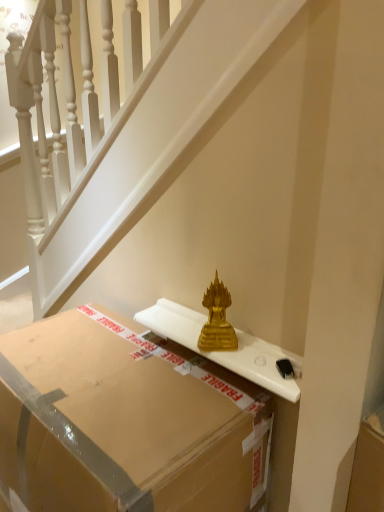
Locate an element on the screen. This screenshot has width=384, height=512. matte cardboard box at center is located at coordinates (124, 422).

Find the location of a particular element. matte cardboard box at center is located at coordinates (124, 422).

Who is smaller, matte cardboard box at center or gold metallic statue at center?

gold metallic statue at center.

Is matte cardboard box at center to the left or to the right of gold metallic statue at center in the image?

matte cardboard box at center is to the left of gold metallic statue at center.

Can you confirm if matte cardboard box at center is wider than gold metallic statue at center?

Correct, the width of matte cardboard box at center exceeds that of gold metallic statue at center.

Looking at this image, is matte cardboard box at center surrounding gold metallic statue at center?

No.

Looking at the image, does matte cardboard box at center seem bigger or smaller compared to gold glass sculpture at center?

In the image, matte cardboard box at center appears to be larger than gold glass sculpture at center.

Which object is closer to the camera taking this photo, matte cardboard box at center or gold glass sculpture at center?

matte cardboard box at center is in front.

Locate an element on the screen. Image resolution: width=384 pixels, height=512 pixels. sculpture above the matte cardboard box at center (from a real-world perspective) is located at coordinates (217, 320).

Are gold metallic statue at center and gold glass sculpture at center making contact?

gold metallic statue at center is not next to gold glass sculpture at center, and they're not touching.

Does point (198, 82) lie in front of point (223, 312)?

Yes.

Considering their positions, is gold metallic statue at center located in front of or behind gold glass sculpture at center?

In the image, gold metallic statue at center appears in front of gold glass sculpture at center.

Is gold glass sculpture at center further to the viewer compared to matte cardboard box at center?

Yes.

Are gold glass sculpture at center and matte cardboard box at center located far from each other?

No, gold glass sculpture at center is not far from matte cardboard box at center.

Is gold glass sculpture at center smaller than matte cardboard box at center?

Indeed, gold glass sculpture at center has a smaller size compared to matte cardboard box at center.

At what (x,y) coordinates should I click in order to perform the action: click on sculpture below the gold metallic statue at center (from the image's perspective). Please return your answer as a coordinate pair (x, y). The image size is (384, 512). Looking at the image, I should click on (217, 320).

Based on the photo, does gold glass sculpture at center lie in front of gold metallic statue at center?

No, gold glass sculpture at center is further to the viewer.

Considering the relative sizes of gold glass sculpture at center and gold metallic statue at center in the image provided, is gold glass sculpture at center thinner than gold metallic statue at center?

Incorrect, the width of gold glass sculpture at center is not less than that of gold metallic statue at center.

Is gold glass sculpture at center oriented away from gold metallic statue at center?

Correct, gold glass sculpture at center is looking away from gold metallic statue at center.

Is gold metallic statue at center looking in the opposite direction of matte cardboard box at center?

Yes, gold metallic statue at center is positioned with its back facing matte cardboard box at center.

Is the surface of gold metallic statue at center in direct contact with matte cardboard box at center?

gold metallic statue at center and matte cardboard box at center are clearly separated.

From a real-world perspective, is gold metallic statue at center physically located above or below matte cardboard box at center?

From a real-world perspective, gold metallic statue at center is physically above matte cardboard box at center.

From the image's perspective, which is below, gold metallic statue at center or matte cardboard box at center?

matte cardboard box at center, from the image's perspective.

Find the location of a particular element. The image size is (384, 512). stairwell that appears behind the matte cardboard box at center is located at coordinates (124, 123).

You are a GUI agent. You are given a task and a screenshot of the screen. Output one action in this format:
    pyautogui.click(x=<x>, y=<y>)
    Task: Click on the box lying below the gold glass sculpture at center (from the image's perspective)
    The height and width of the screenshot is (512, 384).
    Given the screenshot: What is the action you would take?
    pyautogui.click(x=124, y=422)

From the image, which object appears to be nearer to gold metallic statue at center, matte cardboard box at center or gold glass sculpture at center?

matte cardboard box at center.

Looking at this image, when comparing their distances from gold glass sculpture at center, does gold metallic statue at center or matte cardboard box at center seem further?

gold metallic statue at center lies further to gold glass sculpture at center than the other object.

When comparing their distances from matte cardboard box at center, does gold glass sculpture at center or gold metallic statue at center seem further?

Based on the image, gold metallic statue at center appears to be further to matte cardboard box at center.

Considering their positions, is gold metallic statue at center positioned closer to matte cardboard box at center than gold glass sculpture at center?

Among the two, gold glass sculpture at center is located nearer to matte cardboard box at center.

When comparing their distances from gold glass sculpture at center, does matte cardboard box at center or gold metallic statue at center seem closer?

matte cardboard box at center lies closer to gold glass sculpture at center than the other object.

When comparing their distances from gold metallic statue at center, does gold glass sculpture at center or matte cardboard box at center seem closer?

matte cardboard box at center.

Where is `sculpture between gold metallic statue at center and matte cardboard box at center from top to bottom`? sculpture between gold metallic statue at center and matte cardboard box at center from top to bottom is located at coordinates (217, 320).